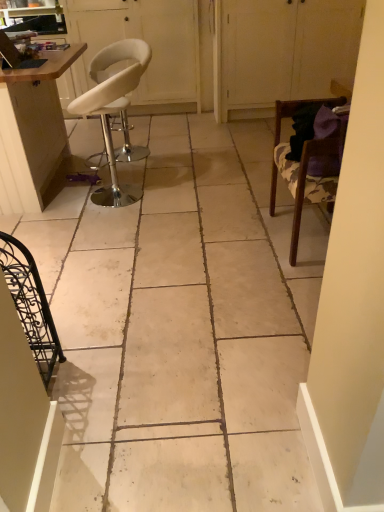
You are a GUI agent. You are given a task and a screenshot of the screen. Output one action in this format:
    pyautogui.click(x=<x>, y=<y>)
    Task: Click on the free space to the left of wooden chair at right, placed as the second chair when sorted from back to front
    
    Given the screenshot: What is the action you would take?
    pyautogui.click(x=227, y=242)